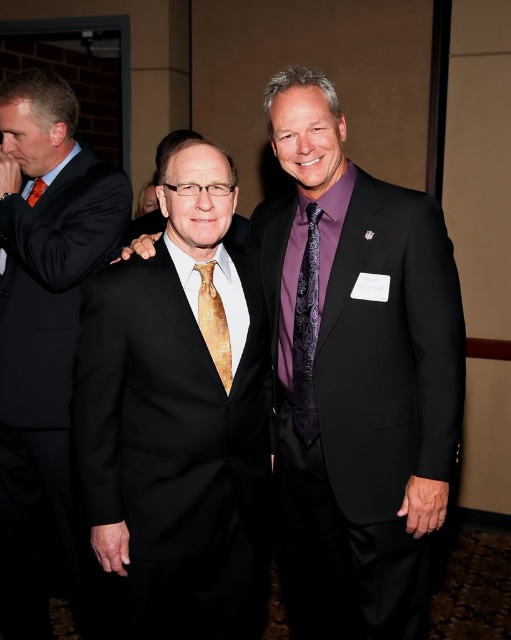
Question: Can you confirm if purple satin tie at center is wider than orange silk tie at left?

Choices:
 (A) no
 (B) yes

Answer: (B)

Question: Which point is closer to the camera taking this photo?

Choices:
 (A) tap(298, 428)
 (B) tap(49, 83)

Answer: (A)

Question: Does matte black suit at left lie behind purple satin tie at center?

Choices:
 (A) no
 (B) yes

Answer: (B)

Question: Which point is farther to the camera?

Choices:
 (A) matte black suit at center
 (B) purple satin tie at center

Answer: (B)

Question: Which point is farther to the camera?

Choices:
 (A) purple satin tie at center
 (B) gold silk tie at center
 (C) matte black suit at center
 (D) matte black suit at left

Answer: (D)

Question: Is black satin suit at center positioned behind purple satin tie at center?

Choices:
 (A) no
 (B) yes

Answer: (A)